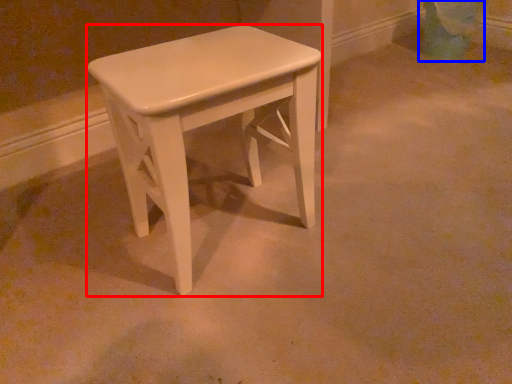
Question: Among these objects, which one is nearest to the camera, stool (highlighted by a red box) or swivel chair (highlighted by a blue box)?

Choices:
 (A) stool
 (B) swivel chair

Answer: (A)